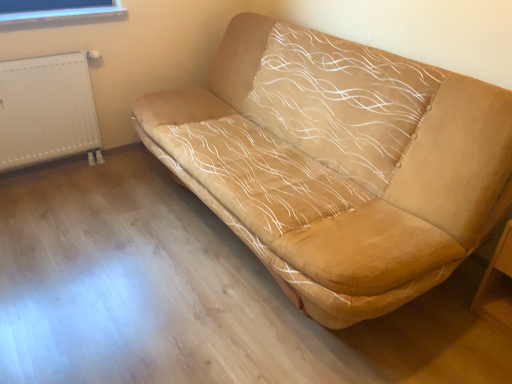
You are a GUI agent. You are given a task and a screenshot of the screen. Output one action in this format:
    pyautogui.click(x=<x>, y=<y>)
    Task: Click on the vacant space situated on the left part of wooden table at lower right
    This screenshot has height=384, width=512.
    Given the screenshot: What is the action you would take?
    pyautogui.click(x=458, y=317)